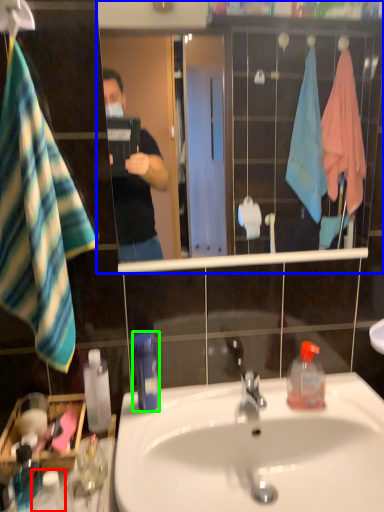
Question: Which object is the closest to the bottle (highlighted by a red box)? Choose among these: mirror (highlighted by a blue box) or bottle (highlighted by a green box).

Choices:
 (A) mirror
 (B) bottle

Answer: (B)